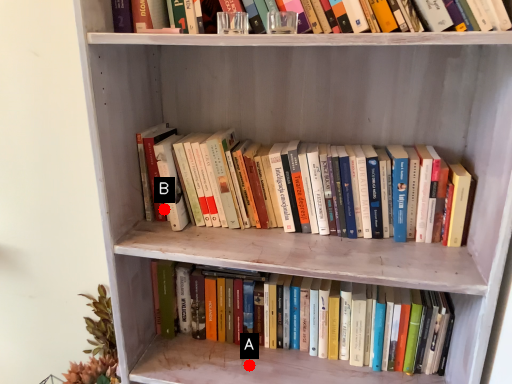
Question: Two points are circled on the image, labeled by A and B beside each circle. Which point appears closest to the camera in this image?

Choices:
 (A) A is closer
 (B) B is closer

Answer: (B)